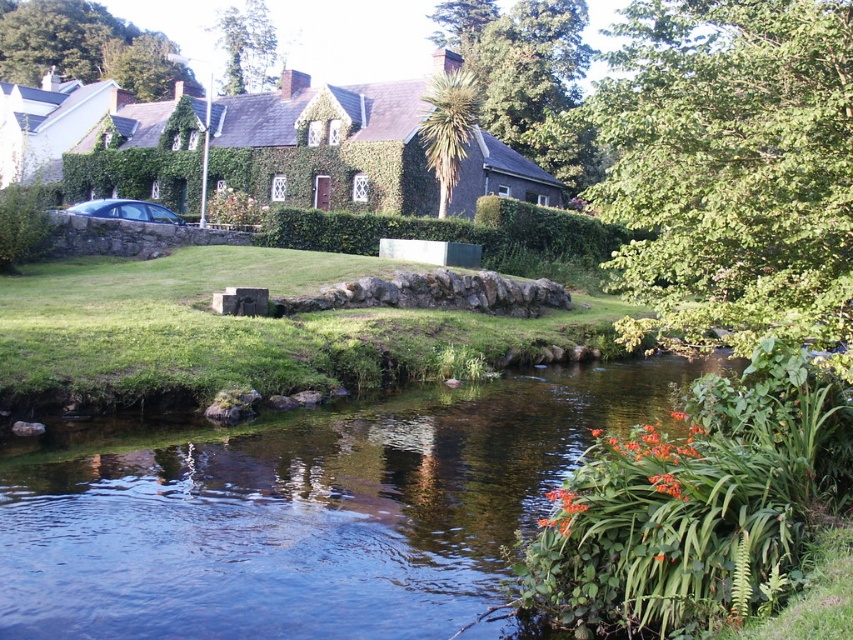
You are standing in front of the traditional stone house and want to take a photo. You notice two points marked in the scene. The first point is at coordinate point (x=358, y=609) and the second is at point (x=109, y=198). Which point is closer to your current position?

The point at coordinate point (x=358, y=609) is closer to your current position because it is closer to the camera than point (x=109, y=198).